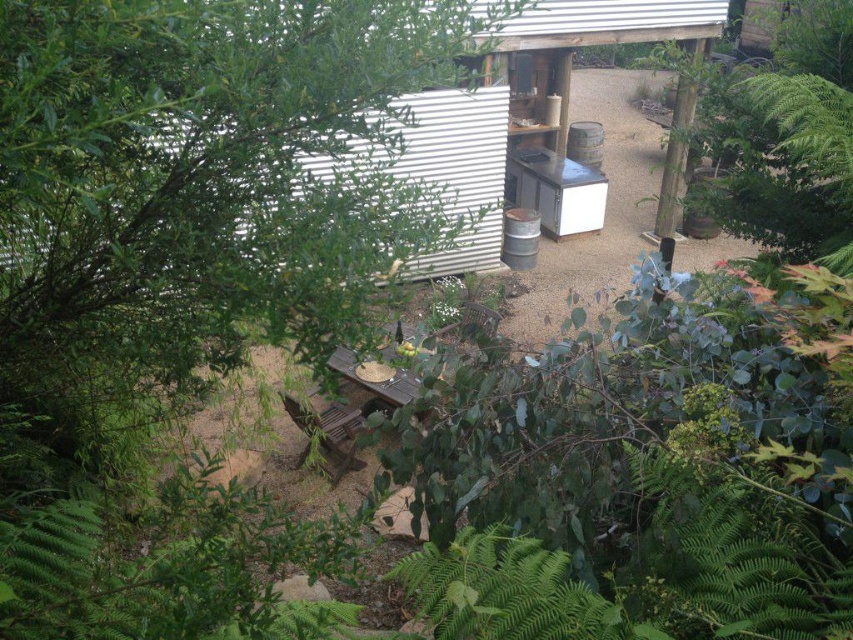
You are planning to set up a small garden in the area between the metallic corrugated hut at upper center and the brown wooden picnic table at center. Considering their sizes, which object might require more space to accommodate your garden setup?

The brown wooden picnic table at center requires more space because it is larger than the metallic corrugated hut at upper center according to the description.

You are standing in the backyard and want to walk to the brown wooden picnic table at center. Which direction should you move relative to the metallic corrugated hut at upper center?

Since the metallic corrugated hut at upper center is closer to you than the brown wooden picnic table at center, you should move away from the metallic corrugated hut at upper center to reach the brown wooden picnic table at center.

You are planning to set up a small outdoor event and need to know which object has a smaller width between the metallic corrugated hut at upper center and the brown wooden picnic table at center. Could you determine which one is narrower?

The metallic corrugated hut at upper center has a smaller width than the brown wooden picnic table at center, making it the narrower object.